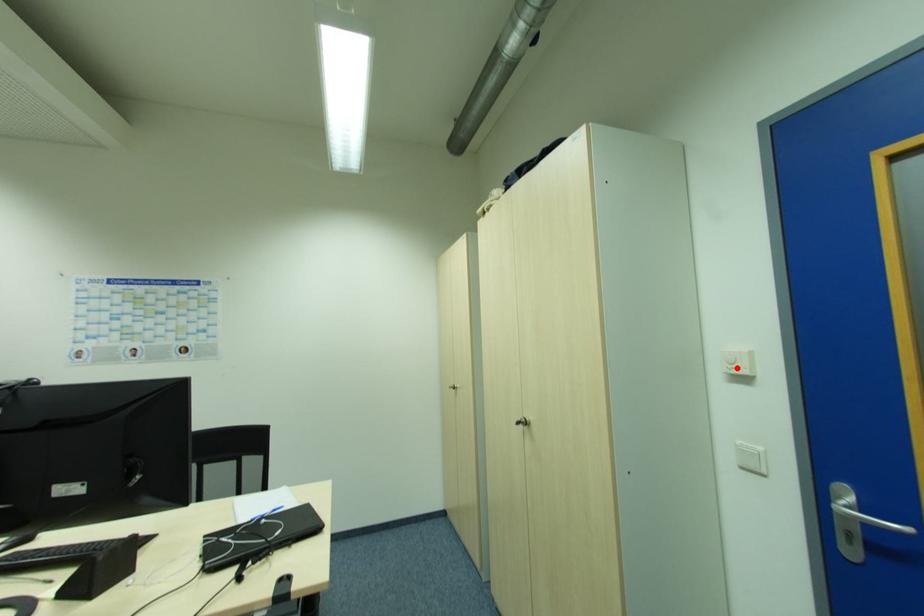
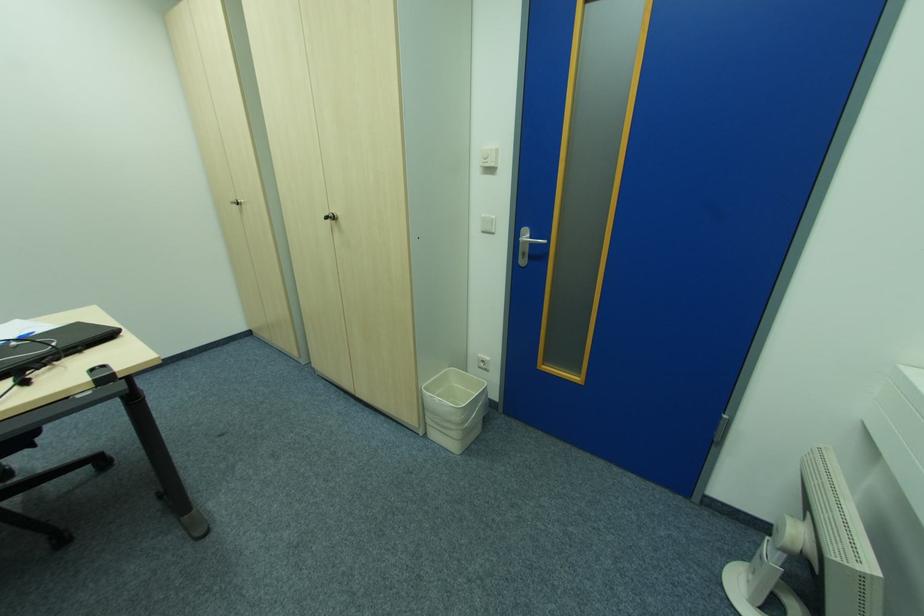
Where in the second image is the point corresponding to the highlighted location from the first image?

(489, 161)